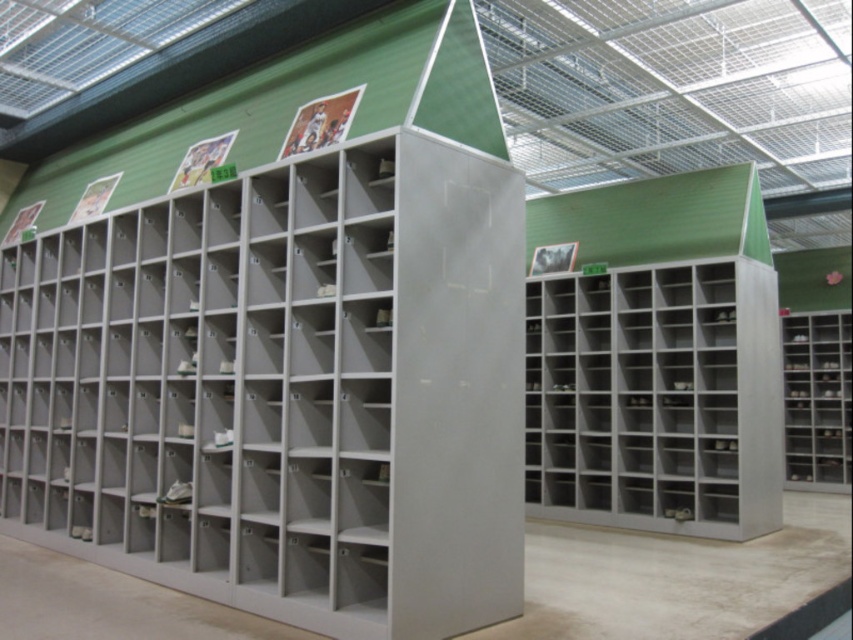
Question: Can you confirm if matte gray bookshelf at center is thinner than metallic gray bookshelf at center?

Choices:
 (A) yes
 (B) no

Answer: (B)

Question: Which of the following is the closest to the observer?

Choices:
 (A) matte gray bookshelf at center
 (B) metallic gray bookshelf at right
 (C) metallic gray bookshelf at center

Answer: (A)

Question: Does matte gray bookshelf at center have a larger size compared to metallic gray bookshelf at right?

Choices:
 (A) no
 (B) yes

Answer: (B)

Question: Estimate the real-world distances between objects in this image. Which object is farther from the metallic gray bookshelf at center?

Choices:
 (A) matte gray bookshelf at center
 (B) metallic gray bookshelf at right

Answer: (B)

Question: Is metallic gray bookshelf at center smaller than metallic gray bookshelf at right?

Choices:
 (A) yes
 (B) no

Answer: (B)

Question: Which point is closer to the camera?

Choices:
 (A) metallic gray bookshelf at center
 (B) metallic gray bookshelf at right

Answer: (A)